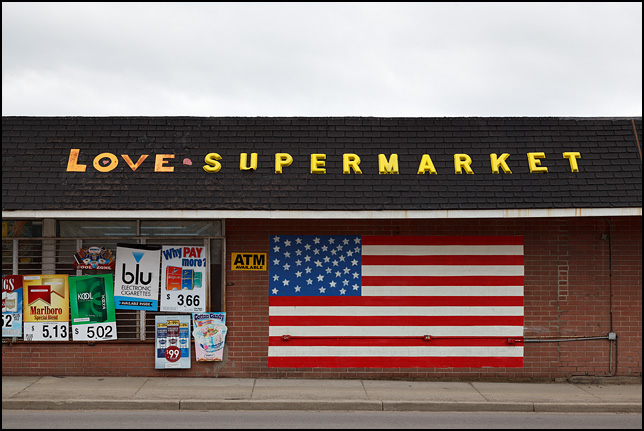
Locate an element on the screen. The width and height of the screenshot is (644, 431). wall below sales posters is located at coordinates (55, 358).